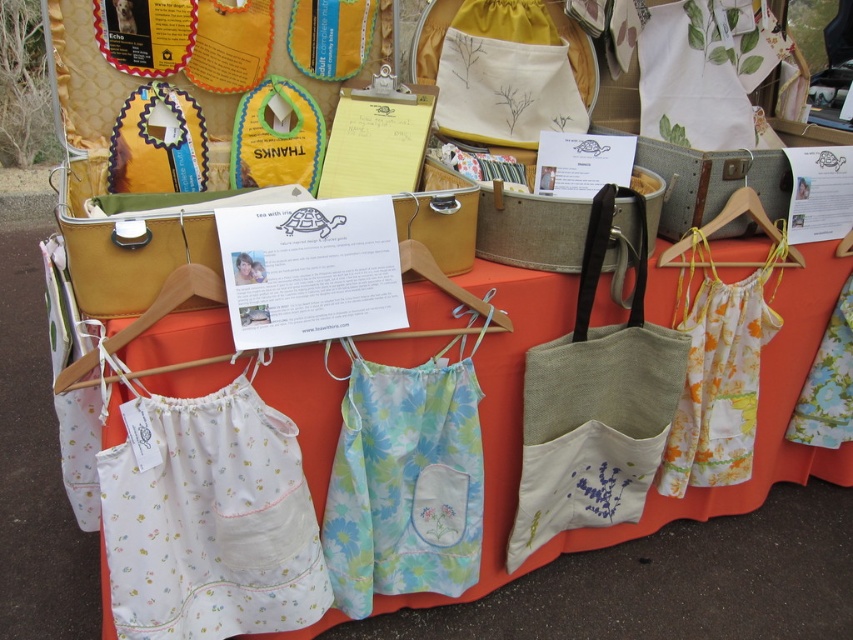
Question: Is white cotton apron at lower left thinner than natural linen tote at center?

Choices:
 (A) yes
 (B) no

Answer: (A)

Question: Is white cotton apron at lower left positioned before natural linen tote at center?

Choices:
 (A) no
 (B) yes

Answer: (B)

Question: Which point is closer to the camera taking this photo?

Choices:
 (A) (292, 436)
 (B) (668, 360)

Answer: (A)

Question: Does white cotton apron at lower left lie behind natural linen tote at center?

Choices:
 (A) yes
 (B) no

Answer: (B)